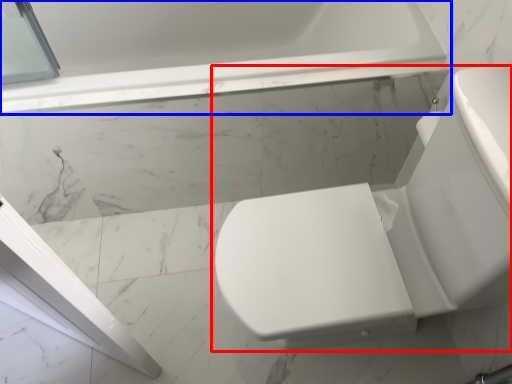
Question: Which of the following is the farthest to the observer, toilet (highlighted by a red box) or bathtub (highlighted by a blue box)?

Choices:
 (A) toilet
 (B) bathtub

Answer: (B)